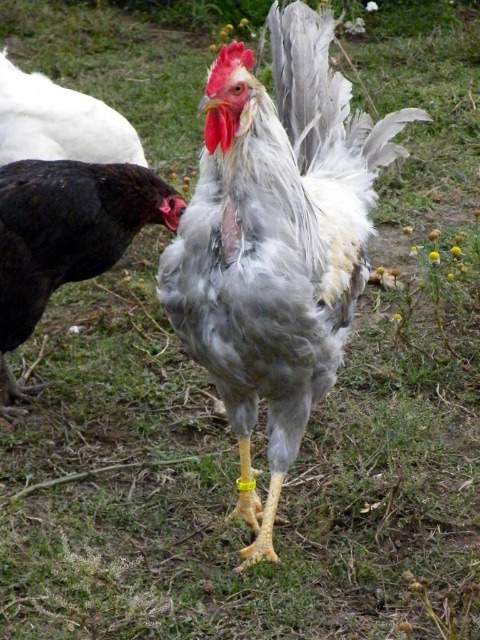
Question: Which point is farther to the camera?

Choices:
 (A) (14, 90)
 (B) (31, 172)
 (C) (227, 314)

Answer: (A)

Question: Does white feathered rooster at center have a smaller size compared to white feathered chicken at upper left?

Choices:
 (A) no
 (B) yes

Answer: (A)

Question: Can you confirm if white feathered rooster at center is positioned to the right of white feathered chicken at upper left?

Choices:
 (A) yes
 (B) no

Answer: (A)

Question: Which object is the farthest from the white feathered rooster at center?

Choices:
 (A) shiny black chicken at left
 (B) white feathered chicken at upper left

Answer: (B)

Question: Does shiny black chicken at left have a lesser width compared to white feathered chicken at upper left?

Choices:
 (A) yes
 (B) no

Answer: (B)

Question: Which object appears farthest from the camera in this image?

Choices:
 (A) shiny black chicken at left
 (B) white feathered chicken at upper left
 (C) white feathered rooster at center

Answer: (B)